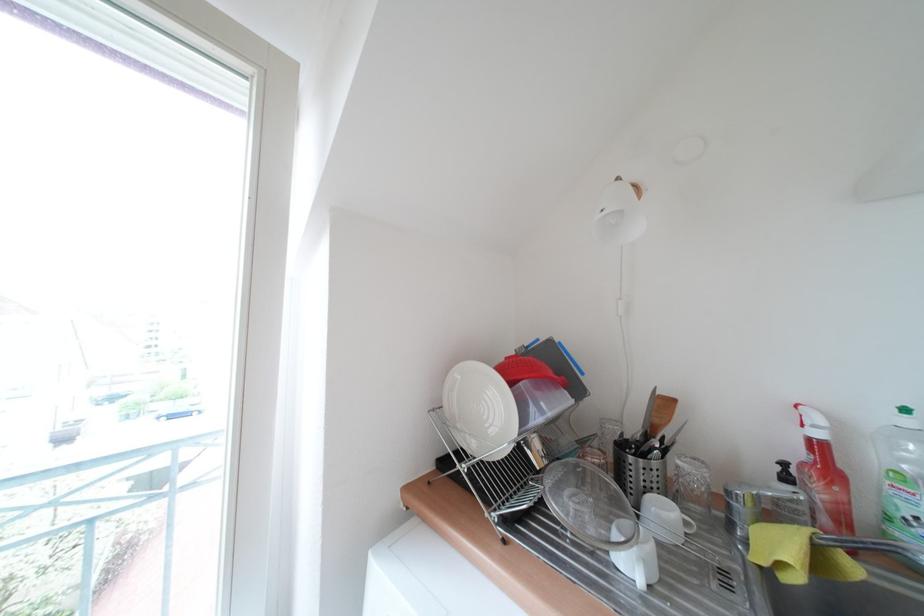
Image resolution: width=924 pixels, height=616 pixels. What do you see at coordinates (901, 476) in the screenshot?
I see `a green bottle cap` at bounding box center [901, 476].